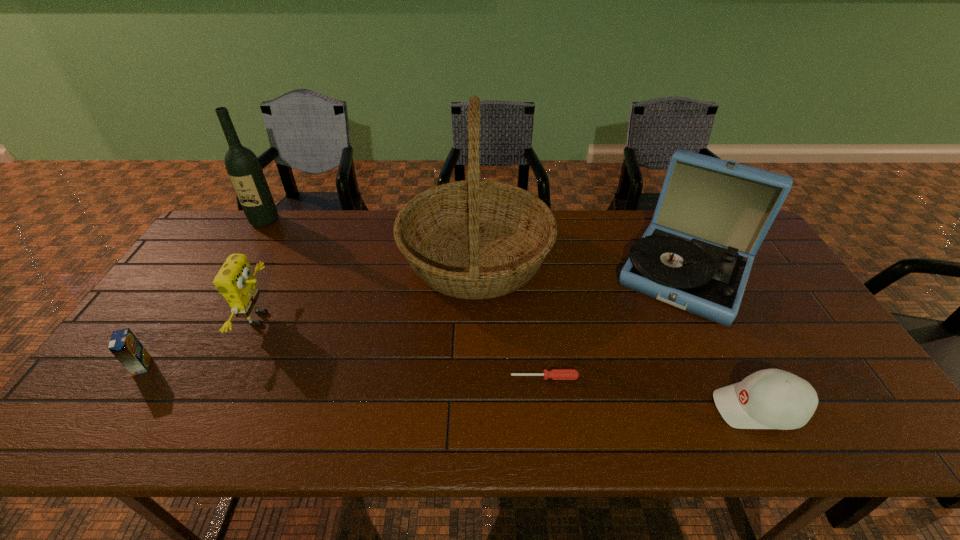
Locate an element on the screen. This screenshot has width=960, height=540. phonograph record situated at the far edge is located at coordinates (712, 215).

The width and height of the screenshot is (960, 540). Find the location of `object located at the near edge`. object located at the near edge is located at coordinates (771, 398).

Image resolution: width=960 pixels, height=540 pixels. I want to click on wine bottle that is positioned at the left edge, so click(243, 167).

Locate an element on the screen. This screenshot has width=960, height=540. orange_juice present at the left edge is located at coordinates (124, 345).

The width and height of the screenshot is (960, 540). In order to click on object that is at the right edge in this screenshot , I will do `click(712, 215)`.

I want to click on object located in the far left corner section of the desktop, so click(243, 167).

Identify the location of object present at the far right corner. (712, 215).

Identify the location of free region at the far edge. The width and height of the screenshot is (960, 540). (347, 253).

The height and width of the screenshot is (540, 960). In the image, there is a desktop. What are the coordinates of `vacant space at the near edge` in the screenshot? It's located at (431, 412).

Image resolution: width=960 pixels, height=540 pixels. What are the coordinates of `vacant space at the left edge of the desktop` in the screenshot? It's located at (129, 383).